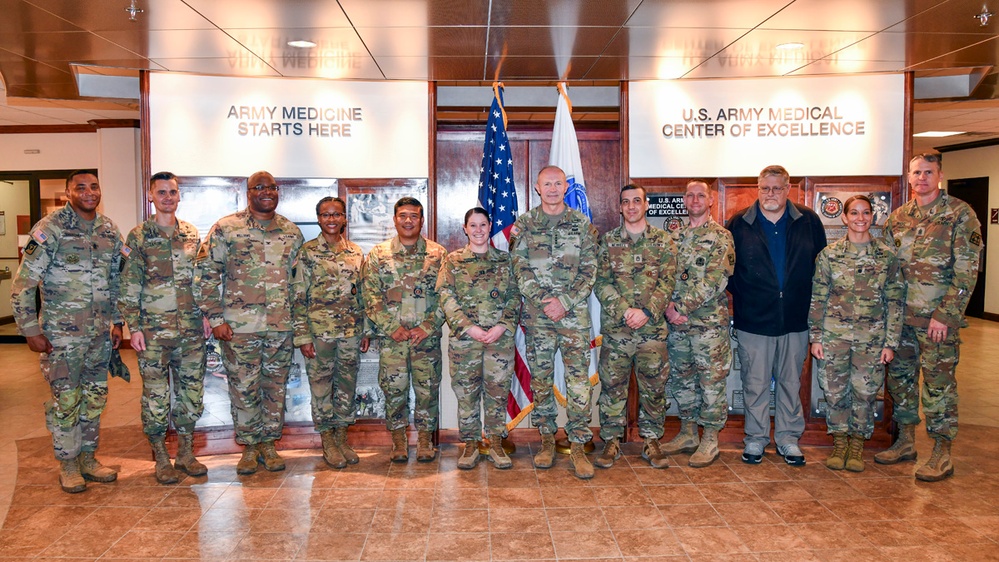
Find the location of a particular element. glass doors is located at coordinates [10, 196], [47, 188].